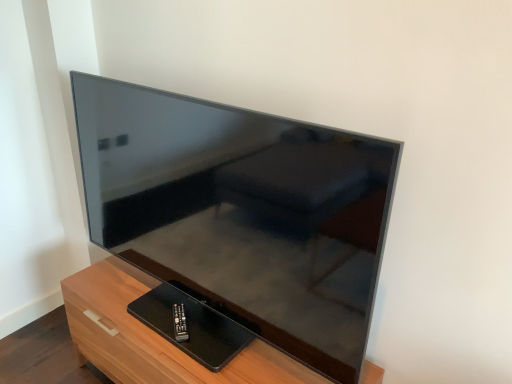
At what (x,y) coordinates should I click in order to perform the action: click on vacant area situated to the left side of black plastic remote at lower center. Please return your answer as a coordinate pair (x, y). This screenshot has height=384, width=512. Looking at the image, I should click on (133, 315).